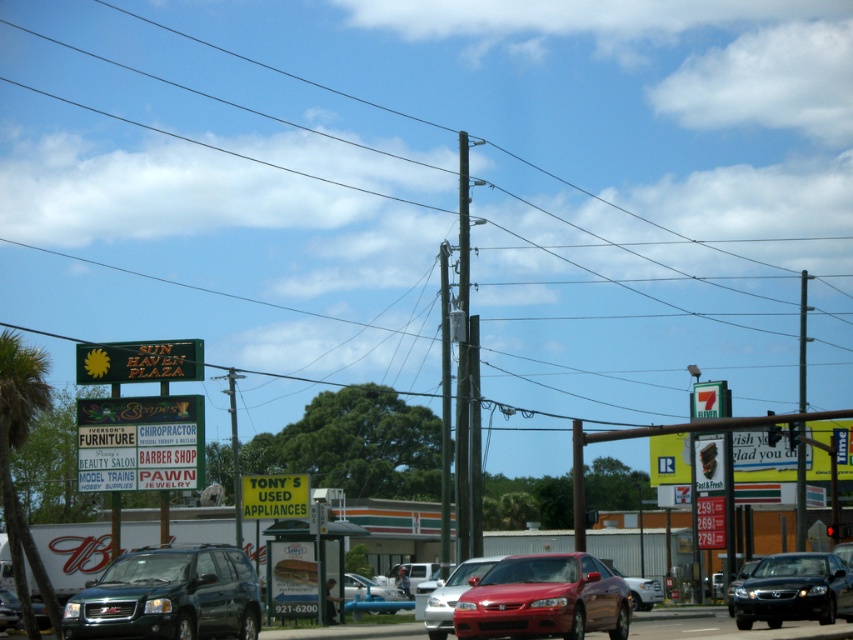
Question: Which object is closer to the camera taking this photo?

Choices:
 (A) shiny dark blue suv at lower left
 (B) shiny metallic sedan at center
 (C) matte red sedan at center

Answer: (B)

Question: Based on their relative distances, which object is nearer to the green wooden pole at center?

Choices:
 (A) green plastic signboard at center
 (B) green plastic sign at lower center

Answer: (A)

Question: Which of the following is the closest to the observer?

Choices:
 (A) shiny metallic sedan at center
 (B) green wooden pole at center
 (C) matte red sedan at center
 (D) green plastic sign at upper left

Answer: (A)

Question: Is green wooden pole at center wider than shiny dark blue suv at lower left?

Choices:
 (A) no
 (B) yes

Answer: (B)

Question: Does smooth gray pole at center come behind matte red sedan at center?

Choices:
 (A) yes
 (B) no

Answer: (A)

Question: Is shiny metallic sedan at center above silver metallic sedan at center?

Choices:
 (A) yes
 (B) no

Answer: (A)